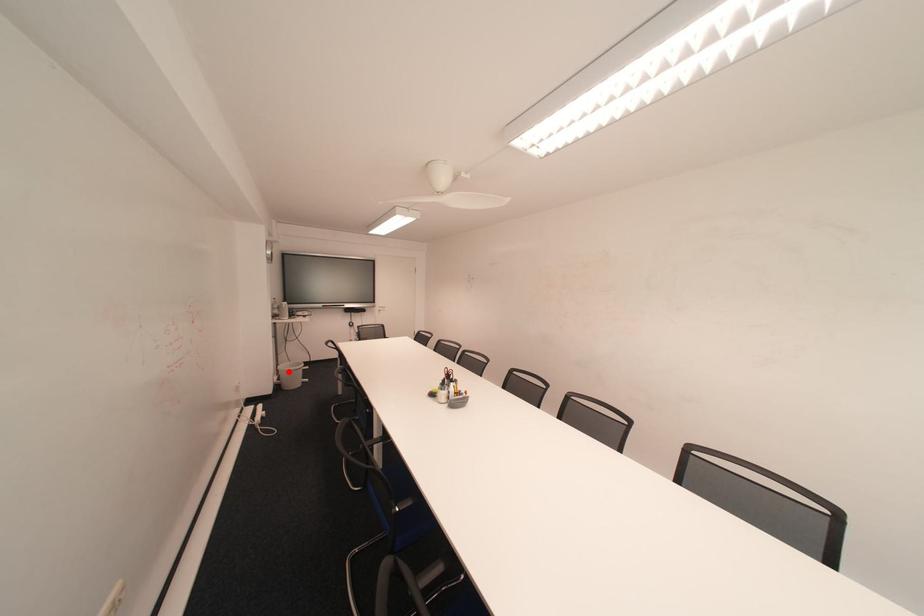
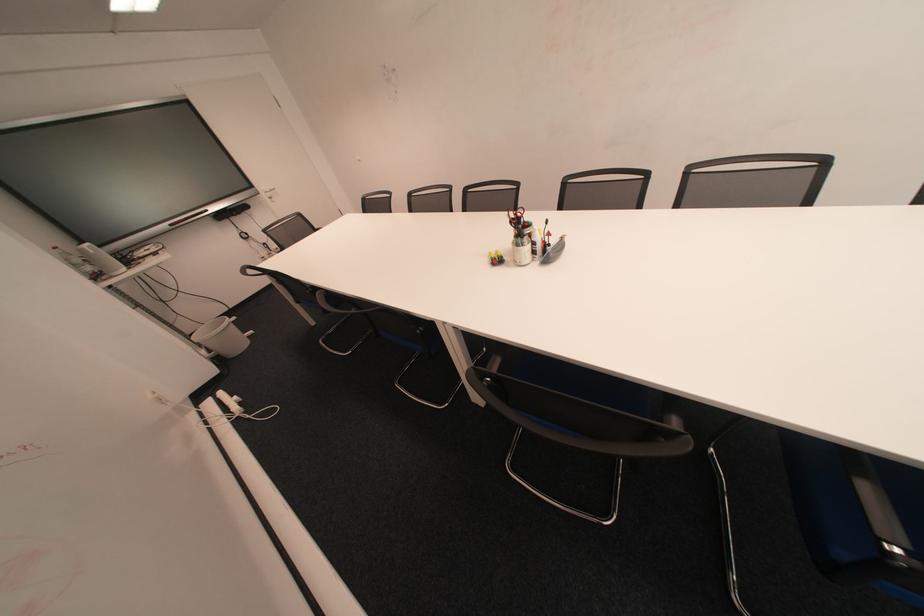
The point at the highlighted location is marked in the first image. Where is the corresponding point in the second image?

(209, 345)